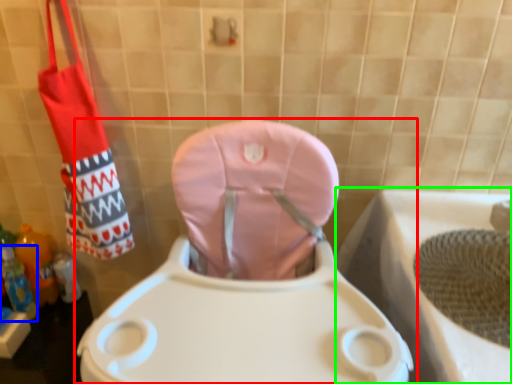
Question: Which object is positioned closest to toilet (highlighted by a red box)? Select from bottle (highlighted by a blue box) and bath (highlighted by a green box).

Choices:
 (A) bottle
 (B) bath

Answer: (B)